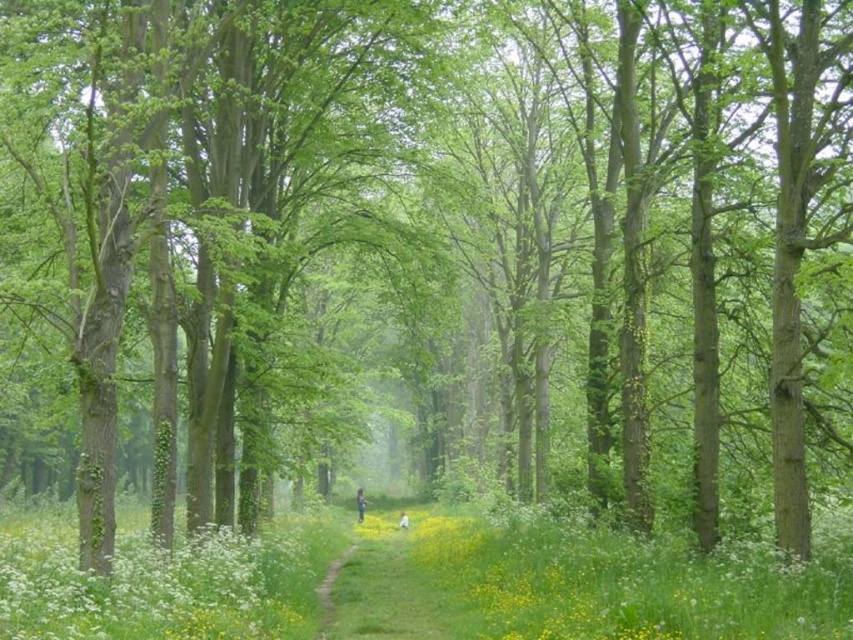
Which is behind, point (451, 625) or point (117, 605)?

The point (451, 625) is more distant.

Between green soft grass at lower center and white fluffy flowers at lower left, which one has more height?

With more height is green soft grass at lower center.

The image size is (853, 640). What do you see at coordinates (416, 580) in the screenshot?
I see `green soft grass at lower center` at bounding box center [416, 580].

Locate an element on the screen. The width and height of the screenshot is (853, 640). green soft grass at lower center is located at coordinates (416, 580).